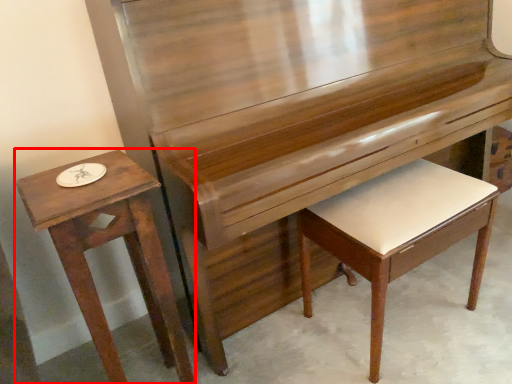
Question: Considering the relative positions of table (annotated by the red box) and music stool in the image provided, where is table (annotated by the red box) located with respect to the staircase?

Choices:
 (A) right
 (B) left

Answer: (B)